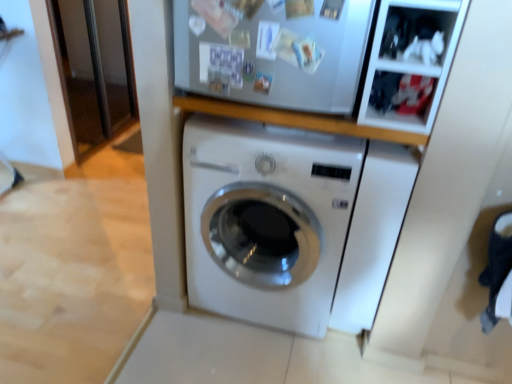
Question: Considering the relative positions of white glossy washing machine at center, acting as the 2th washing machine starting from the left, and white glossy washing machine at center, which appears as the first washing machine when viewed from the left, in the image provided, is white glossy washing machine at center, acting as the 2th washing machine starting from the left, to the left or to the right of white glossy washing machine at center, which appears as the first washing machine when viewed from the left,?

Choices:
 (A) left
 (B) right

Answer: (B)

Question: Do you think white glossy washing machine at center, which appears as the first washing machine when viewed from the right, is within white glossy washing machine at center, the 2th washing machine positioned from the right, or outside of it?

Choices:
 (A) outside
 (B) inside

Answer: (A)

Question: In the image, is white glossy washing machine at center, which appears as the first washing machine when viewed from the right, positioned in front of or behind white glossy washing machine at center, which appears as the first washing machine when viewed from the left?

Choices:
 (A) behind
 (B) front

Answer: (A)

Question: Based on their positions, is white glossy washing machine at center, the 2th washing machine positioned from the right, located to the left or right of white glossy washing machine at center, acting as the 2th washing machine starting from the left?

Choices:
 (A) right
 (B) left

Answer: (B)

Question: Considering their positions, is white glossy washing machine at center, which appears as the first washing machine when viewed from the left, located in front of or behind white glossy washing machine at center, which appears as the first washing machine when viewed from the right?

Choices:
 (A) front
 (B) behind

Answer: (A)

Question: Considering the positions of white glossy washing machine at center, the 2th washing machine positioned from the right, and white glossy washing machine at center, which appears as the first washing machine when viewed from the right, in the image, is white glossy washing machine at center, the 2th washing machine positioned from the right, bigger or smaller than white glossy washing machine at center, which appears as the first washing machine when viewed from the right,?

Choices:
 (A) big
 (B) small

Answer: (A)

Question: Is white glossy washing machine at center, which appears as the first washing machine when viewed from the left, wider or thinner than white glossy washing machine at center, which appears as the first washing machine when viewed from the right?

Choices:
 (A) wide
 (B) thin

Answer: (A)